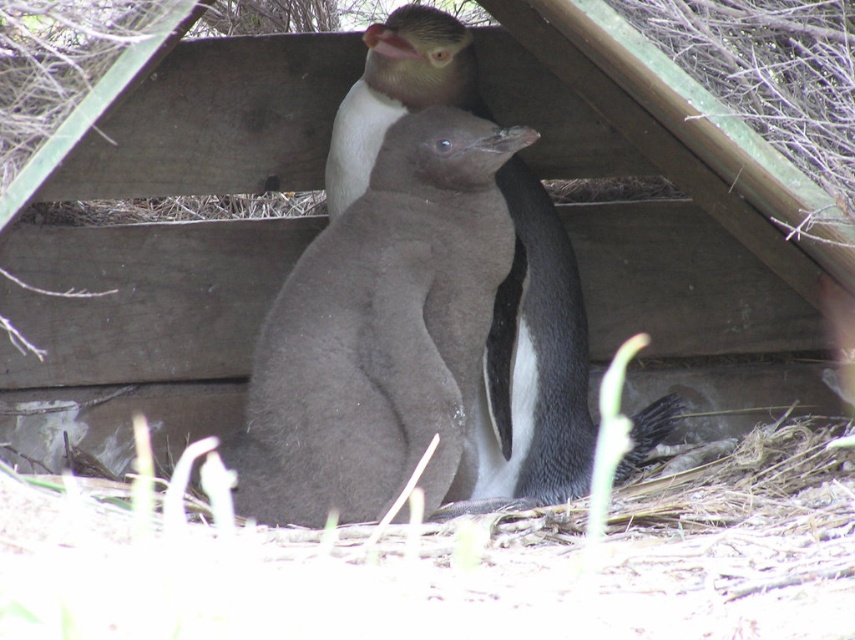
You are a zookeeper standing at the camera position observing the dark gray downy penguin at center. You need to feed it with a fish that you are holding in your hand. The fish is 1 foot long. The safety guideline says that you must maintain at least 10 feet distance from the penguin to avoid stressing it. Can you safely feed the penguin without violating the guideline?

The dark gray downy penguin at center is 9.27 feet from the camera. Since the required safe distance is 10 feet, the zookeeper is too close to safely feed the penguin without violating the guideline.

You are a zookeeper observing the penguins under the wooden shelter. You notice two dark gray features at the center. Which one is nearer to you, the dark gray downy penguin at center or the dark gray feathers at center?

The dark gray downy penguin at center is closer to the viewer than the dark gray feathers at center.

You are a zookeeper observing two penguins under a wooden shelter. You notice the dark gray downy penguin at center and the dark gray feathers at center. Which of these two has a shorter height?

The dark gray downy penguin at center is shorter than dark gray feathers at center.